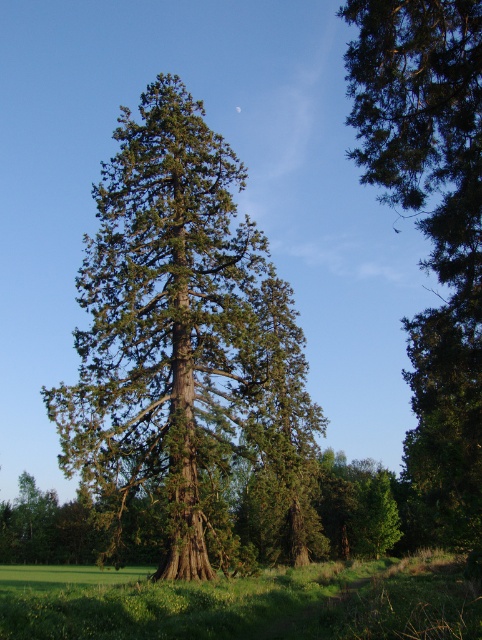
Question: Is green textured tree at right thinner than green grassy field at lower center?

Choices:
 (A) yes
 (B) no

Answer: (A)

Question: Can you confirm if green rough bark tree at center is positioned below green textured tree at right?

Choices:
 (A) no
 (B) yes

Answer: (A)

Question: Which object is farther from the camera taking this photo?

Choices:
 (A) green rough bark tree at center
 (B) green textured tree at right
 (C) green grassy field at lower center

Answer: (A)

Question: Does green textured tree at right appear under green grassy field at lower center?

Choices:
 (A) yes
 (B) no

Answer: (B)

Question: Which point is farther to the camera?

Choices:
 (A) (479, 160)
 (B) (244, 266)

Answer: (B)

Question: Which point is farther to the camera?

Choices:
 (A) green rough bark tree at center
 (B) green textured tree at right
 (C) green grassy field at lower center

Answer: (A)